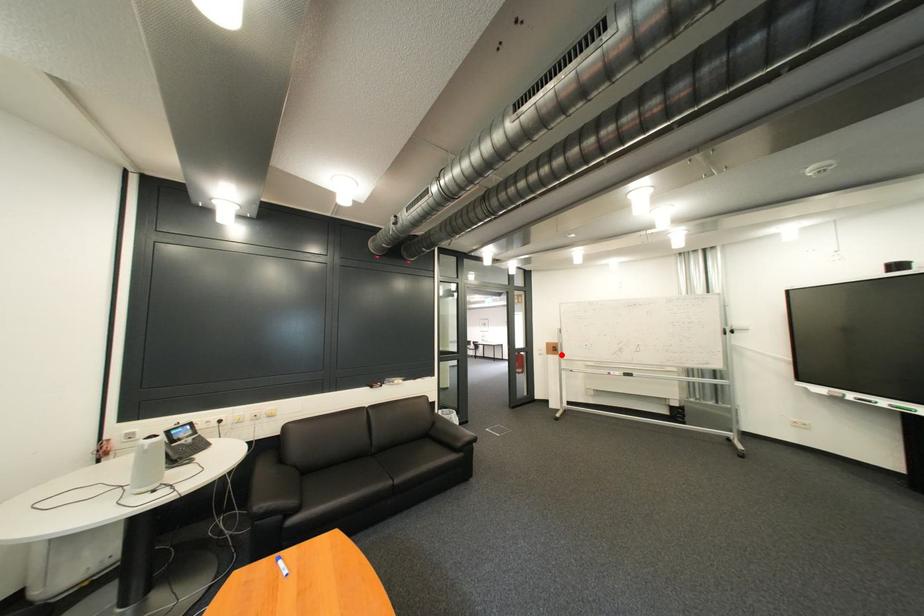
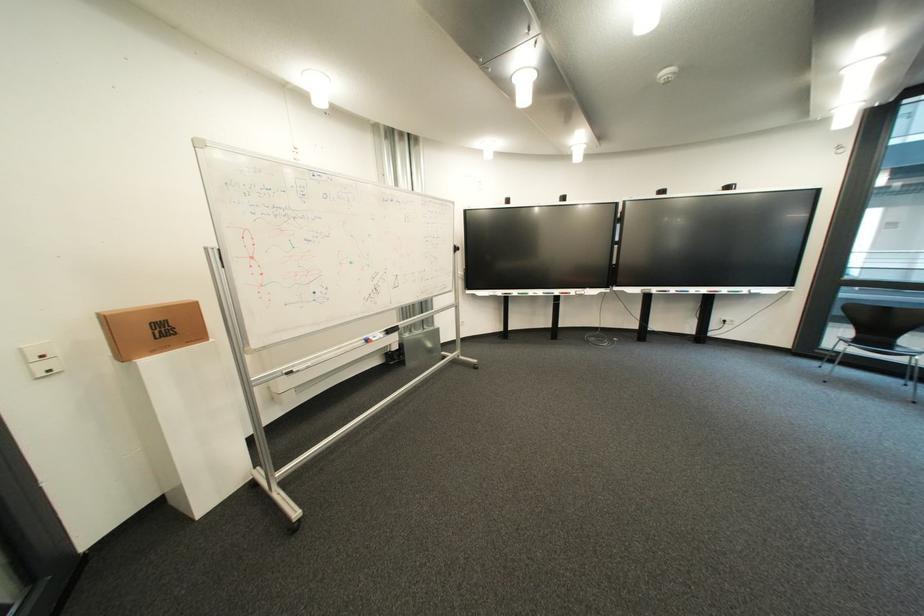
Find the pixel in the second image that matches the highlighted location in the first image.

(139, 358)